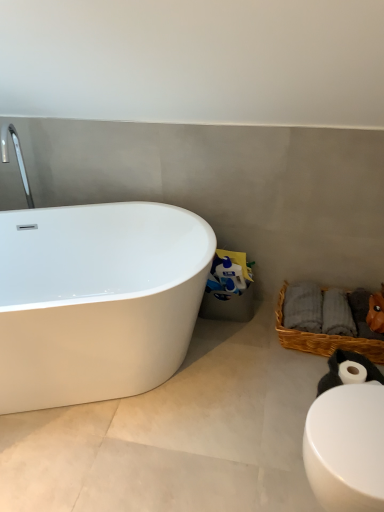
Question: Is white glossy bathtub at left wider than white matte toilet paper roll at lower right?

Choices:
 (A) yes
 (B) no

Answer: (A)

Question: Considering the relative positions of white glossy bathtub at left and white matte toilet paper roll at lower right in the image provided, is white glossy bathtub at left to the right of white matte toilet paper roll at lower right from the viewer's perspective?

Choices:
 (A) no
 (B) yes

Answer: (A)

Question: Is white glossy bathtub at left located outside white matte toilet paper roll at lower right?

Choices:
 (A) yes
 (B) no

Answer: (A)

Question: Considering the relative positions of white glossy bathtub at left and white matte toilet paper roll at lower right in the image provided, is white glossy bathtub at left to the left of white matte toilet paper roll at lower right from the viewer's perspective?

Choices:
 (A) yes
 (B) no

Answer: (A)

Question: Is white glossy bathtub at left facing towards white matte toilet paper roll at lower right?

Choices:
 (A) no
 (B) yes

Answer: (A)

Question: Is white glossy bathtub at left taller or shorter than woven brown basket at lower right?

Choices:
 (A) short
 (B) tall

Answer: (B)

Question: Considering the positions of white glossy bathtub at left and woven brown basket at lower right in the image, is white glossy bathtub at left bigger or smaller than woven brown basket at lower right?

Choices:
 (A) small
 (B) big

Answer: (B)

Question: Is point (92, 238) positioned closer to the camera than point (367, 340)?

Choices:
 (A) farther
 (B) closer

Answer: (A)

Question: Relative to woven brown basket at lower right, is white glossy bathtub at left in front or behind?

Choices:
 (A) behind
 (B) front

Answer: (B)

Question: From the image's perspective, is woven brown basket at lower right positioned above or below white matte toilet paper roll at lower right?

Choices:
 (A) above
 (B) below

Answer: (A)

Question: In terms of height, does woven brown basket at lower right look taller or shorter compared to white matte toilet paper roll at lower right?

Choices:
 (A) short
 (B) tall

Answer: (B)

Question: Is woven brown basket at lower right inside the boundaries of white matte toilet paper roll at lower right, or outside?

Choices:
 (A) outside
 (B) inside

Answer: (A)

Question: Would you say woven brown basket at lower right is to the left or to the right of white matte toilet paper roll at lower right in the picture?

Choices:
 (A) left
 (B) right

Answer: (B)

Question: Considering the positions of white matte toilet paper roll at lower right and white glossy bathtub at left in the image, is white matte toilet paper roll at lower right bigger or smaller than white glossy bathtub at left?

Choices:
 (A) big
 (B) small

Answer: (B)

Question: Do you think white matte toilet paper roll at lower right is within white glossy bathtub at left, or outside of it?

Choices:
 (A) outside
 (B) inside

Answer: (A)